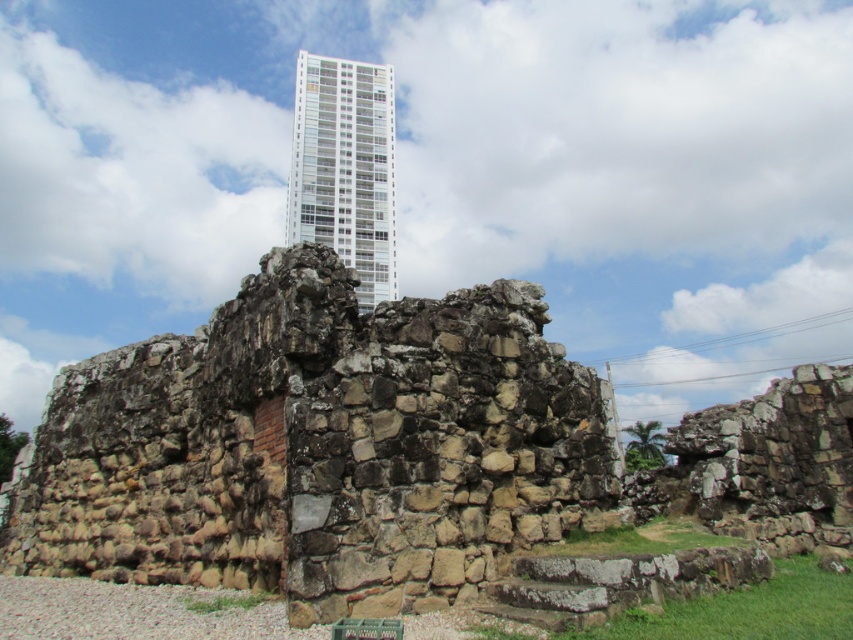
Question: Can you confirm if brown stone ruins at center is bigger than white glassy building at upper center?

Choices:
 (A) yes
 (B) no

Answer: (B)

Question: Which point is closer to the camera?

Choices:
 (A) brown stone ruins at center
 (B) white glassy building at upper center

Answer: (A)

Question: Which object appears farthest from the camera in this image?

Choices:
 (A) brown stone ruins at center
 (B) white glassy building at upper center

Answer: (B)

Question: Which object is closer to the camera taking this photo?

Choices:
 (A) brown stone ruins at center
 (B) white glassy building at upper center

Answer: (A)

Question: Is brown stone ruins at center above white glassy building at upper center?

Choices:
 (A) no
 (B) yes

Answer: (A)

Question: Is brown stone ruins at center thinner than white glassy building at upper center?

Choices:
 (A) yes
 (B) no

Answer: (A)